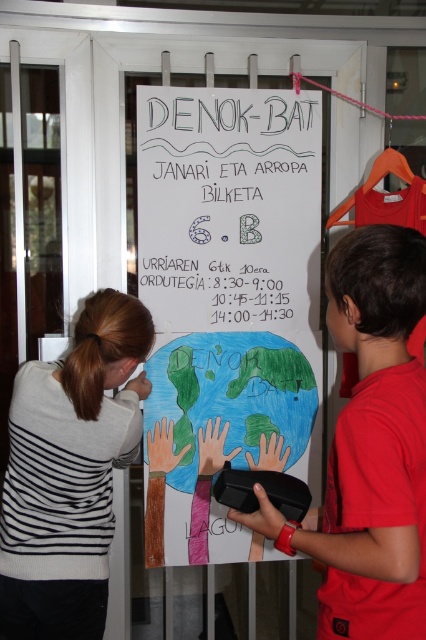
Which is more to the left, red matte shirt at right or black paper at center?

From the viewer's perspective, black paper at center appears more on the left side.

Is point (342, 552) farther from camera compared to point (232, 292)?

No, (342, 552) is in front of (232, 292).

Between point (348, 451) and point (244, 312), which one is positioned in front?

Point (348, 451)

Locate an element on the screen. This screenshot has height=640, width=426. red matte shirt at right is located at coordinates (371, 445).

Is white paper at center to the right of black paper at center from the viewer's perspective?

Yes, white paper at center is to the right of black paper at center.

Who is shorter, white paper at center or black paper at center?

With less height is black paper at center.

Where is `white paper at center`? white paper at center is located at coordinates (227, 305).

I want to click on white paper at center, so [227, 305].

Based on the photo, between red matte shirt at right and striped sweater at left, which one appears on the right side from the viewer's perspective?

red matte shirt at right

Can you confirm if red matte shirt at right is positioned to the right of striped sweater at left?

Yes, red matte shirt at right is to the right of striped sweater at left.

At what (x,y) coordinates should I click in order to perform the action: click on red matte shirt at right. Please return your answer as a coordinate pair (x, y). Looking at the image, I should click on (371, 445).